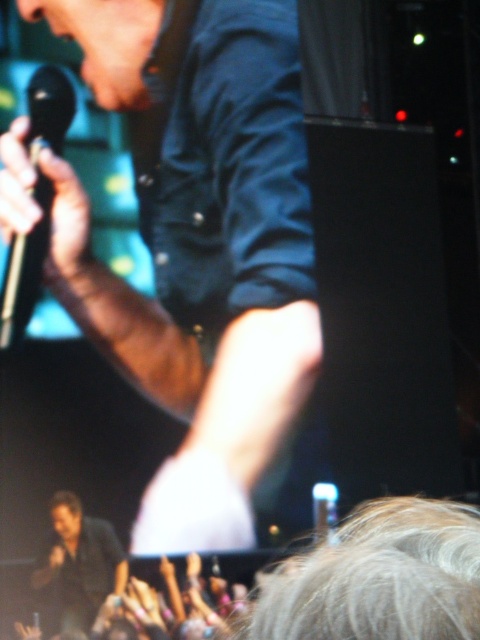
Based on the photo, who is higher up, dark blue shirt at lower left or black metallic microphone at left?

black metallic microphone at left is higher up.

Which is more to the right, dark blue shirt at lower left or black metallic microphone at left?

dark blue shirt at lower left

Where is `dark blue shirt at lower left`? The width and height of the screenshot is (480, 640). dark blue shirt at lower left is located at coordinates (80, 561).

Between matte black microphone at upper left and black metallic microphone at left, which one has less height?

With less height is black metallic microphone at left.

Who is lower down, matte black microphone at upper left or black metallic microphone at left?

matte black microphone at upper left is lower down.

Identify the location of matte black microphone at upper left. (212, 275).

Is matte black microphone at upper left to the right of dark blue shirt at lower left from the viewer's perspective?

Correct, you'll find matte black microphone at upper left to the right of dark blue shirt at lower left.

Can you confirm if matte black microphone at upper left is bigger than dark blue shirt at lower left?

Yes, matte black microphone at upper left is bigger than dark blue shirt at lower left.

Between point (233, 349) and point (60, 595), which one is positioned in front?

Point (60, 595) is more forward.

This screenshot has height=640, width=480. What are the coordinates of `matte black microphone at upper left` in the screenshot? It's located at (212, 275).